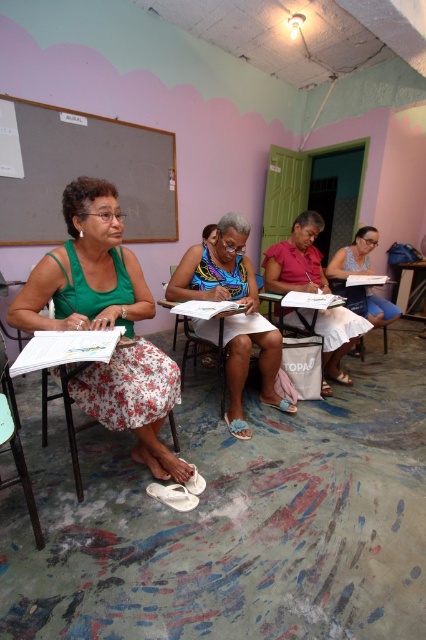
Question: Which point is closer to the camera?

Choices:
 (A) (173, 372)
 (B) (342, 340)
 (C) (417, 273)
 (D) (181, 317)

Answer: (A)

Question: Which object is positioned farthest from the matte grayboard at upper left?

Choices:
 (A) blue floral dress at center
 (B) white paper at right
 (C) wooden table at center
 (D) matte pink shirt at center

Answer: (C)

Question: Can you confirm if matte pink shirt at center is bigger than wooden chair at center?

Choices:
 (A) no
 (B) yes

Answer: (A)

Question: Does wooden table at center appear on the right side of wooden chair at center?

Choices:
 (A) no
 (B) yes

Answer: (B)

Question: Is matte grayboard at upper left to the left of matte pink shirt at center from the viewer's perspective?

Choices:
 (A) no
 (B) yes

Answer: (B)

Question: Which of the following is the farthest from the observer?

Choices:
 (A) (371, 243)
 (B) (394, 276)
 (C) (218, 296)
 (D) (37, 212)

Answer: (B)